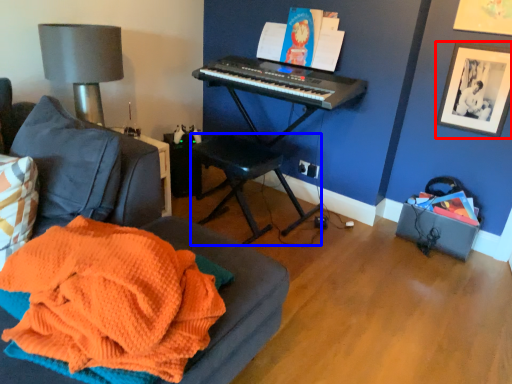
Question: Which point is further to the camera, picture frame (highlighted by a red box) or music stool (highlighted by a blue box)?

Choices:
 (A) picture frame
 (B) music stool

Answer: (A)